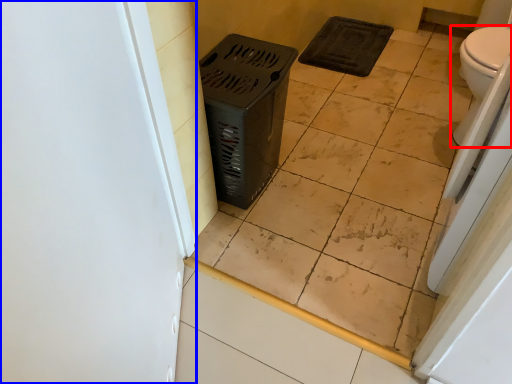
Question: Among these objects, which one is nearest to the camera, toilet (highlighted by a red box) or screen door (highlighted by a blue box)?

Choices:
 (A) toilet
 (B) screen door

Answer: (B)